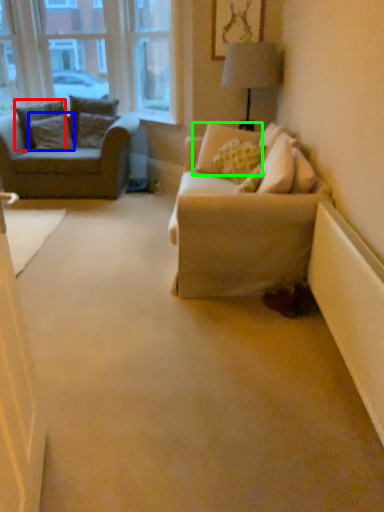
Question: Considering the real-world distances, which object is closest to pillow (highlighted by a red box)? pillow (highlighted by a blue box) or pillow (highlighted by a green box).

Choices:
 (A) pillow
 (B) pillow

Answer: (A)